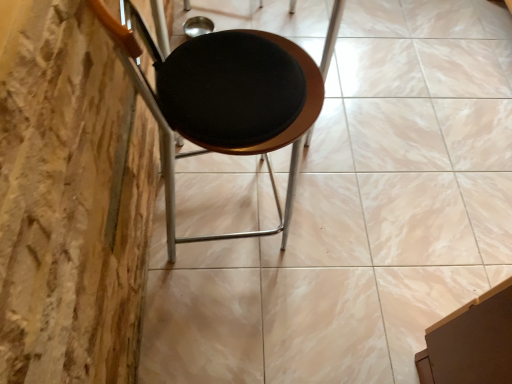
The height and width of the screenshot is (384, 512). Identify the location of free region under matte black stool at center (from a real-world perspective). (234, 208).